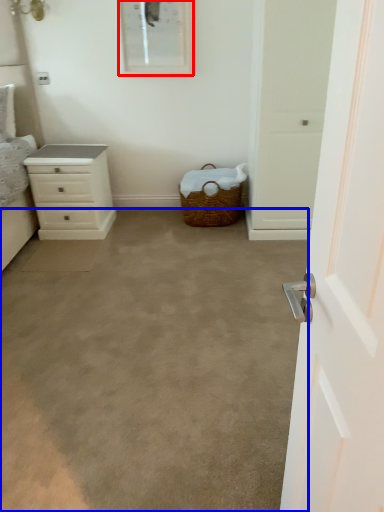
Question: Among these objects, which one is farthest to the camera, picture frame (highlighted by a red box) or plain (highlighted by a blue box)?

Choices:
 (A) picture frame
 (B) plain

Answer: (A)